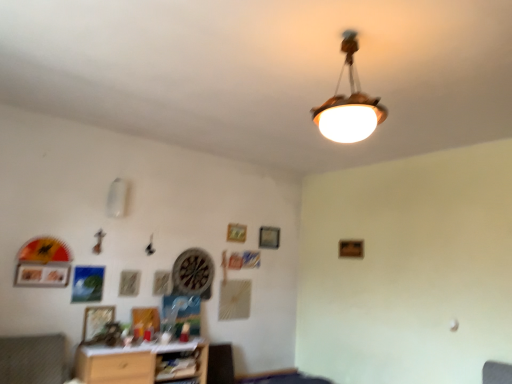
Question: From the image's perspective, does wooden table at lower center appear higher than matte silver picture frame at lower left, positioned as the 1th picture frame in left-to-right order?

Choices:
 (A) no
 (B) yes

Answer: (A)

Question: Is wooden table at lower center aimed at matte silver picture frame at lower left, acting as the third picture frame starting from the right?

Choices:
 (A) yes
 (B) no

Answer: (B)

Question: Is wooden table at lower center turned away from matte silver picture frame at lower left, positioned as the 1th picture frame in left-to-right order?

Choices:
 (A) no
 (B) yes

Answer: (A)

Question: Is wooden table at lower center in contact with matte silver picture frame at lower left, which ranks as the 3th picture frame in back-to-front order?

Choices:
 (A) no
 (B) yes

Answer: (A)

Question: Considering the relative sizes of wooden table at lower center and matte silver picture frame at lower left, acting as the third picture frame starting from the right, in the image provided, is wooden table at lower center wider than matte silver picture frame at lower left, acting as the third picture frame starting from the right,?

Choices:
 (A) no
 (B) yes

Answer: (B)

Question: Does wooden table at lower center lie behind matte silver picture frame at lower left, arranged as the 2th picture frame when ordered from the bottom?

Choices:
 (A) no
 (B) yes

Answer: (A)

Question: Can you confirm if wooden shelf at lower center is thinner than wooden picture frame at upper center, placed as the 3th picture frame when sorted from left to right?

Choices:
 (A) yes
 (B) no

Answer: (B)

Question: From the image's perspective, would you say wooden shelf at lower center is shown under wooden picture frame at upper center, which is the 3th picture frame from bottom to top?

Choices:
 (A) no
 (B) yes

Answer: (B)

Question: Is wooden shelf at lower center not close to wooden picture frame at upper center, arranged as the first picture frame when viewed from the back?

Choices:
 (A) yes
 (B) no

Answer: (A)

Question: Is wooden shelf at lower center behind wooden picture frame at upper center, marked as the 1th picture frame in a right-to-left arrangement?

Choices:
 (A) yes
 (B) no

Answer: (B)

Question: Is wooden shelf at lower center positioned in front of wooden picture frame at upper center, placed as the 3th picture frame when sorted from left to right?

Choices:
 (A) no
 (B) yes

Answer: (B)

Question: Is wooden shelf at lower center oriented towards wooden picture frame at upper center, acting as the first picture frame starting from the top?

Choices:
 (A) yes
 (B) no

Answer: (B)

Question: Is wooden picture frame at upper center, marked as the 3th picture frame in a front-to-back arrangement, not inside textured fabric swivel chair at lower left?

Choices:
 (A) no
 (B) yes

Answer: (B)